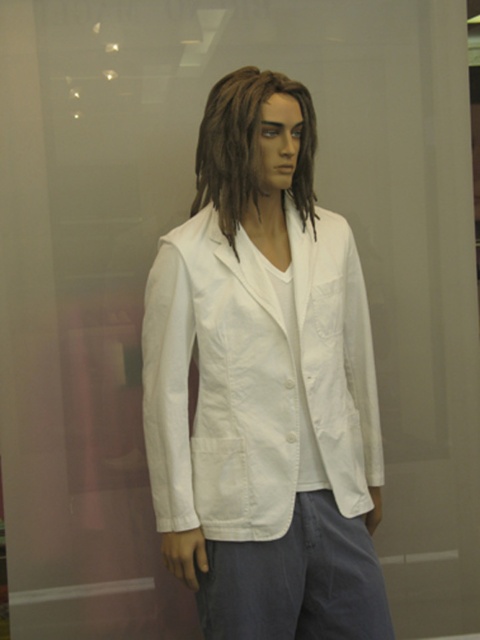
You are a nurse who needs to reach the white cotton lab coat at center to put it on. The nurse is 1.68 meters tall. Can the nurse reach the coat without standing on something?

The white cotton lab coat at center is 1.60 meters from the viewer. Since the nurse is 1.68 meters tall, they can easily reach it without needing to stand on anything.

Looking at this image, you are a fashion designer observing a mannequin in a store window. You notice the denim pants at lower center and the brownhair at center. Which item is positioned lower on the mannequin?

The denim pants at lower center are positioned lower on the mannequin than the brownhair at center.